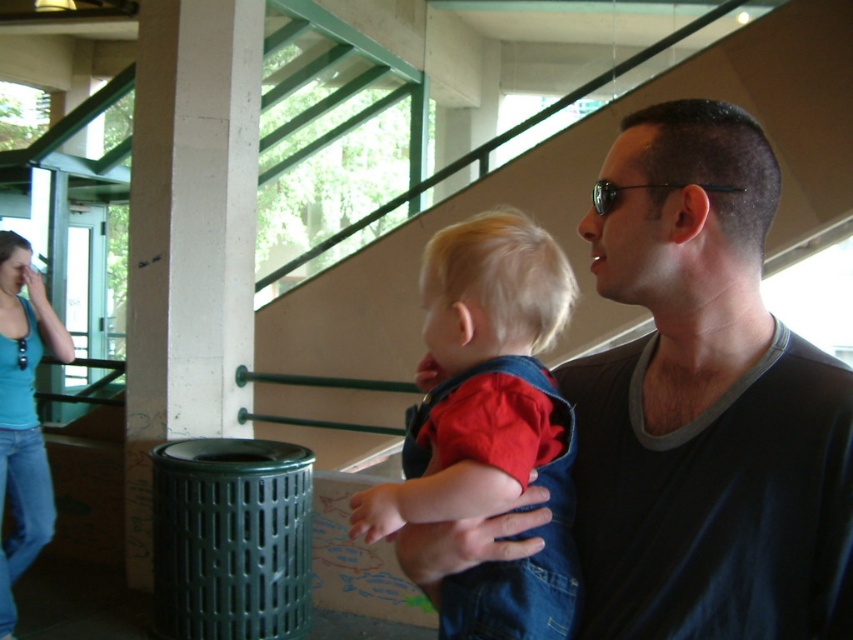
Question: Which point is closer to the camera?

Choices:
 (A) dark gray shirt at center
 (B) denim overalls at center

Answer: (A)

Question: Is the position of dark gray shirt at center less distant than that of blue denim jeans at left?

Choices:
 (A) yes
 (B) no

Answer: (A)

Question: Which object is the closest to the denim overalls at center?

Choices:
 (A) dark gray shirt at center
 (B) blue denim jeans at left

Answer: (A)

Question: Can you confirm if denim overalls at center is thinner than blue denim jeans at left?

Choices:
 (A) no
 (B) yes

Answer: (A)

Question: In this image, where is dark gray shirt at center located relative to blue denim jeans at left?

Choices:
 (A) right
 (B) left

Answer: (A)

Question: Based on their relative distances, which object is farther from the blue denim jeans at left?

Choices:
 (A) denim overalls at center
 (B) dark gray shirt at center

Answer: (B)